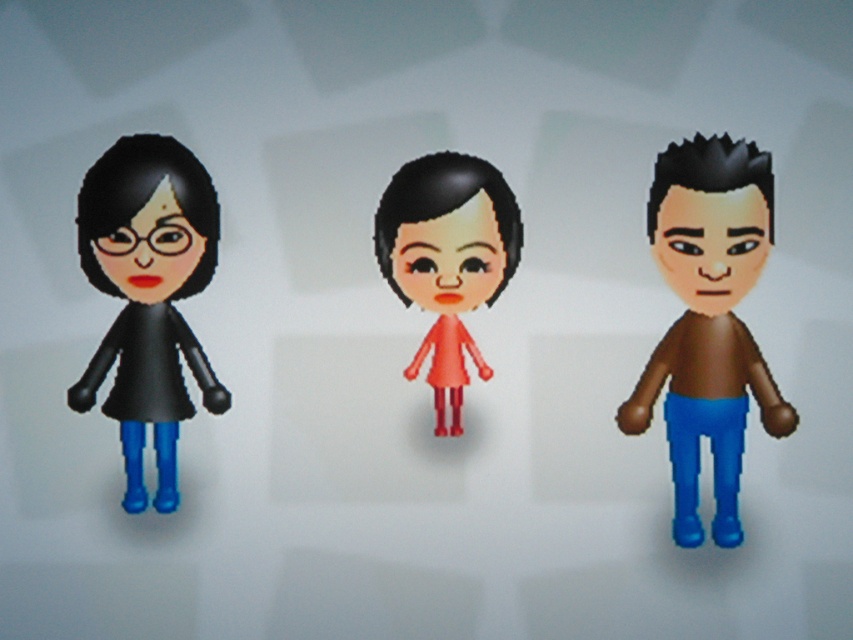
You are an observer looking at the three figures. Which figure has a taller height between the brown matte shirt at right and the black matte doll at left?

The brown matte shirt at right is much taller than the black matte doll at left.